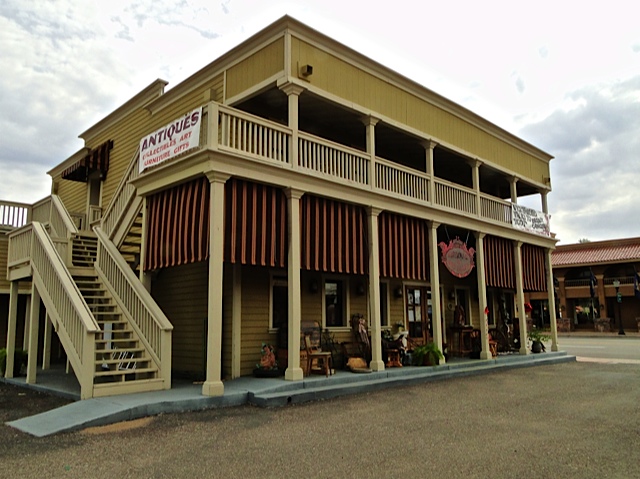
At what (x,y) coordinates should I click in order to perform the action: click on stair handrail. Please return your answer as a coordinate pair (x, y). This screenshot has height=479, width=640. Looking at the image, I should click on (72, 297), (144, 295), (111, 213), (65, 208).